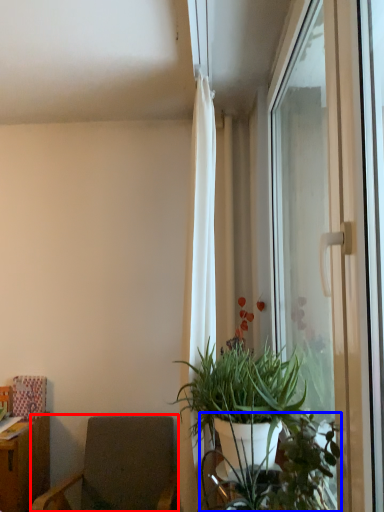
Question: Which object appears farthest to the camera in this image, chair (highlighted by a red box) or vegetation (highlighted by a blue box)?

Choices:
 (A) chair
 (B) vegetation

Answer: (A)